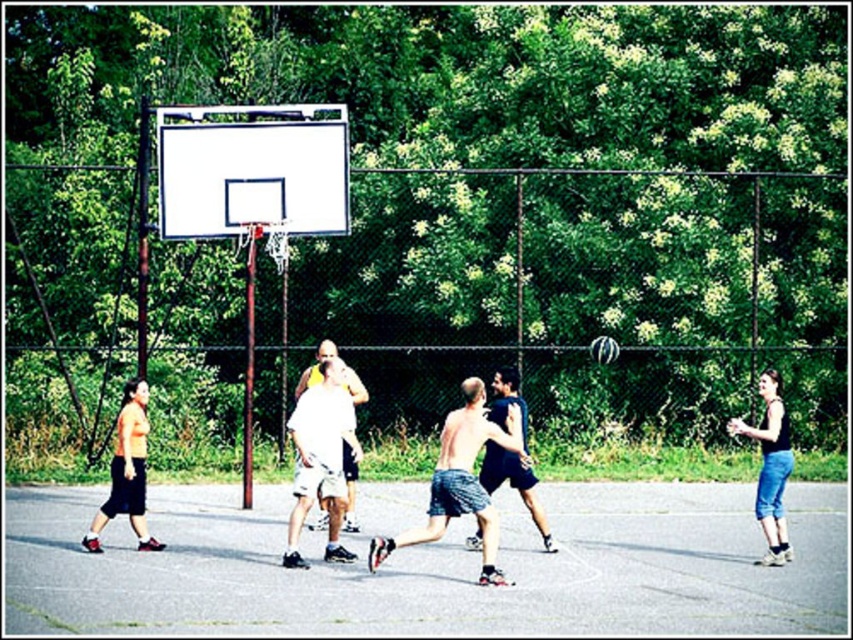
You are a photographer trying to capture a closeup shot of the skinny jeans at center and dark blue shorts at center. Which one should you zoom in on more to ensure they are both clearly visible in the photo?

The skinny jeans at center is bigger than dark blue shorts at center, so you should zoom in more on the skinny jeans at center to ensure both are clearly visible.